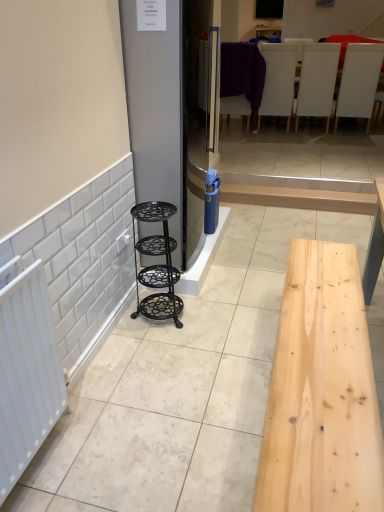
Question: Does point (34, 367) appear closer or farther from the camera than point (177, 77)?

Choices:
 (A) farther
 (B) closer

Answer: (B)

Question: Would you say white matte radiator at left is inside or outside satin silver fridge at center?

Choices:
 (A) inside
 (B) outside

Answer: (B)

Question: Which is nearer to the white leather chairs at upper center, the fourth furniture in the front-to-back sequence?

Choices:
 (A) white matte chair at upper center, positioned as the 2th furniture in right-to-left order
 (B) purple fabric chair at upper center, the fourth furniture positioned from the right
 (C) black wrought iron shelf at center left, marked as the 1th furniture in a front-to-back arrangement
 (D) white matte radiator at left
 (E) white matte chair at upper right, the second furniture when ordered from front to back

Answer: (A)

Question: Estimate the real-world distances between objects in this image. Which object is closer to the white matte radiator at left?

Choices:
 (A) satin silver fridge at center
 (B) white matte chair at upper center, which is counted as the 3th furniture, starting from the front
 (C) purple fabric chair at upper center, the second furniture when ordered from left to right
 (D) white leather chairs at upper center, which appears as the second furniture when viewed from the back
 (E) black wrought iron shelf at center left, arranged as the 5th furniture when viewed from the back

Answer: (E)